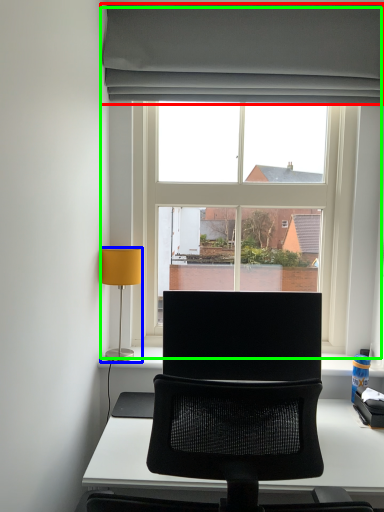
Question: Considering the real-world distances, which object is closest to curtain (highlighted by a red box)? lamp (highlighted by a blue box) or window (highlighted by a green box).

Choices:
 (A) lamp
 (B) window

Answer: (B)